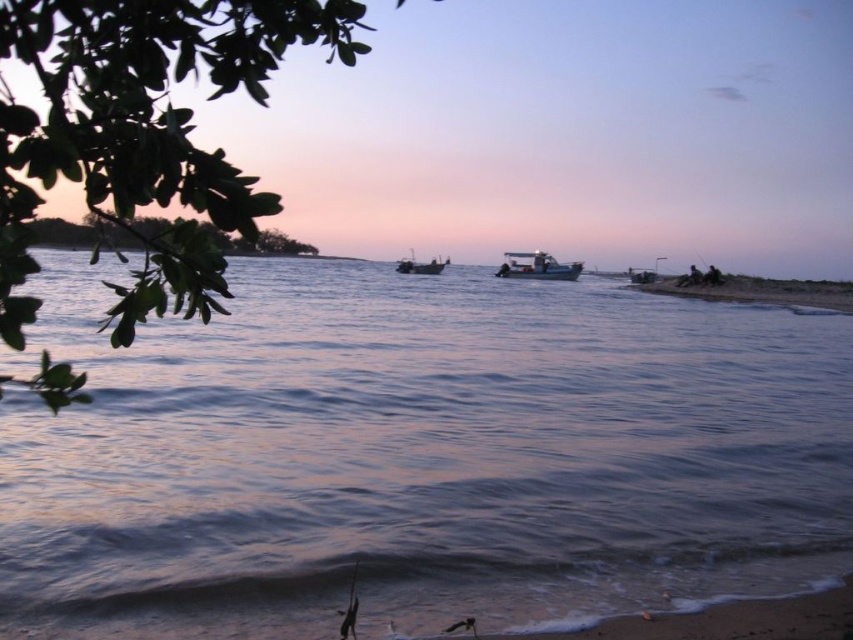
Question: Which of the following is the farthest from the observer?

Choices:
 (A) white plastic boat at center
 (B) smooth water at center

Answer: (A)

Question: Does white plastic boat at center appear on the left side of metallic gray boat at center?

Choices:
 (A) yes
 (B) no

Answer: (B)

Question: Does smooth water at center appear on the right side of white plastic boat at center?

Choices:
 (A) yes
 (B) no

Answer: (B)

Question: Is the position of smooth water at center more distant than that of white plastic boat at center?

Choices:
 (A) no
 (B) yes

Answer: (A)

Question: Which of the following is the farthest from the observer?

Choices:
 (A) (415, 264)
 (B) (566, 392)
 (C) (517, 275)

Answer: (A)

Question: Which point appears farthest from the camera in this image?

Choices:
 (A) (343, 339)
 (B) (543, 275)

Answer: (B)